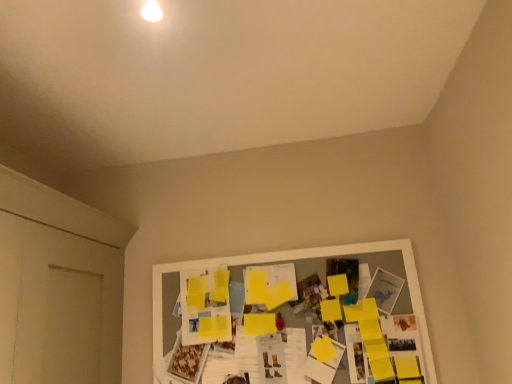
Describe the element at coordinates (58, 305) in the screenshot. This screenshot has width=512, height=384. I see `white matte door at left` at that location.

Based on the photo, what is the approximate width of white matte door at left?

It is 15.47 inches.

Where is `white matte door at left`? Image resolution: width=512 pixels, height=384 pixels. white matte door at left is located at coordinates (58, 305).

The image size is (512, 384). I want to click on yellow paper at center, so click(x=290, y=260).

The width and height of the screenshot is (512, 384). What do you see at coordinates (290, 260) in the screenshot?
I see `yellow paper at center` at bounding box center [290, 260].

Find the location of a particular element. Image resolution: width=512 pixels, height=384 pixels. white matte door at left is located at coordinates (58, 305).

Between white matte door at left and yellow paper at center, which one appears on the left side from the viewer's perspective?

white matte door at left is more to the left.

In the scene shown: Is white matte door at left in front of or behind yellow paper at center in the image?

white matte door at left is in front of yellow paper at center.

Which is in front, point (80, 305) or point (259, 262)?

The point (80, 305) is in front.

From the image's perspective, is white matte door at left above or below yellow paper at center?

Clearly, from the image's perspective, white matte door at left is above yellow paper at center.

From a real-world perspective, is white matte door at left positioned above or below yellow paper at center?

white matte door at left is above yellow paper at center.

Considering the relative sizes of white matte door at left and yellow paper at center in the image provided, is white matte door at left thinner than yellow paper at center?

No, white matte door at left is not thinner than yellow paper at center.

Is white matte door at left shorter than yellow paper at center?

No, white matte door at left is not shorter than yellow paper at center.

Is white matte door at left bigger than yellow paper at center?

Correct, white matte door at left is larger in size than yellow paper at center.

Is yellow paper at center completely or partially inside white matte door at left?

No, white matte door at left does not contain yellow paper at center.

Looking at this image, is white matte door at left positioned far away from yellow paper at center?

No, there isn't a large distance between white matte door at left and yellow paper at center.

Is white matte door at left positioned with its back to yellow paper at center?

No, white matte door at left's orientation is not away from yellow paper at center.

How different are the orientations of white matte door at left and yellow paper at center in degrees?

The angle between the facing direction of white matte door at left and the facing direction of yellow paper at center is 89.7 degrees.

In the image, there is a yellow paper at center. Where is `door above it (from the image's perspective)`? The image size is (512, 384). door above it (from the image's perspective) is located at coordinates (58, 305).

Is yellow paper at center to the left of white matte door at left from the viewer's perspective?

Incorrect, yellow paper at center is not on the left side of white matte door at left.

In the image, is yellow paper at center positioned in front of or behind white matte door at left?

Clearly, yellow paper at center is behind white matte door at left.

Does point (349, 246) come in front of point (88, 319)?

No, (349, 246) is behind (88, 319).

From the image's perspective, is yellow paper at center over white matte door at left?

Incorrect, from the image's perspective, yellow paper at center is lower than white matte door at left.

From a real-world perspective, which is physically above, yellow paper at center or white matte door at left?

white matte door at left.

Is yellow paper at center wider than white matte door at left?

Incorrect, the width of yellow paper at center does not surpass that of white matte door at left.

Is yellow paper at center taller than white matte door at left?

Incorrect, the height of yellow paper at center is not larger of that of white matte door at left.

In terms of size, does yellow paper at center appear bigger or smaller than white matte door at left?

yellow paper at center is smaller than white matte door at left.

Choose the correct answer: Is yellow paper at center inside white matte door at left or outside it?

yellow paper at center is located beyond the bounds of white matte door at left.

Is yellow paper at center far away from white matte door at left?

No, yellow paper at center is not far away from white matte door at left.

Is yellow paper at center positioned with its back to white matte door at left?

No, yellow paper at center's orientation is not away from white matte door at left.

How distant is yellow paper at center from white matte door at left?

18.92 inches.

Locate an element on the screen. door above the yellow paper at center (from the image's perspective) is located at coordinates (58, 305).

Image resolution: width=512 pixels, height=384 pixels. I want to click on door that appears on the left of yellow paper at center, so click(58, 305).

The width and height of the screenshot is (512, 384). Identify the location of bulletin board located below the white matte door at left (from the image's perspective). (290, 260).